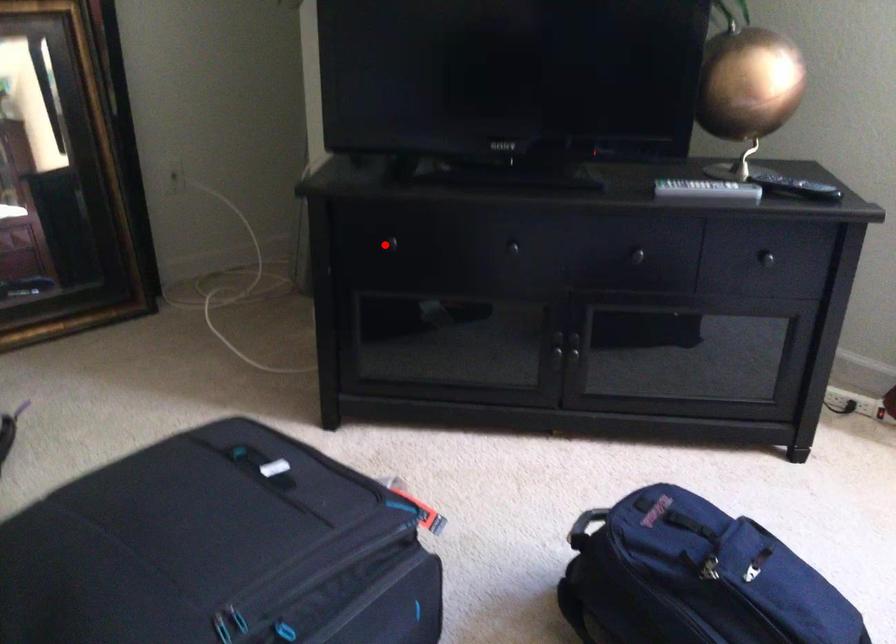
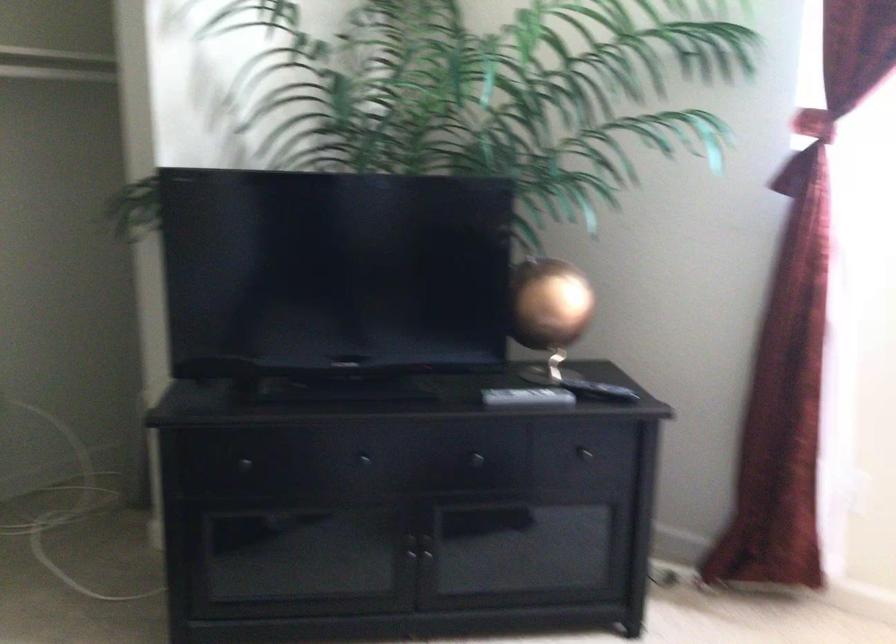
In the second image, find the point that corresponds to the highlighted location in the first image.

(239, 464)